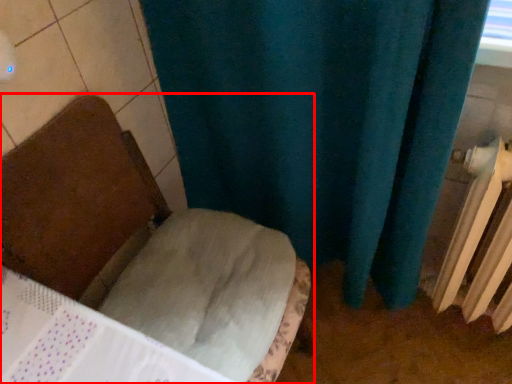
Question: From the image's perspective, what is the correct spatial relationship of furniture (annotated by the red box) in relation to radiator?

Choices:
 (A) below
 (B) above

Answer: (A)